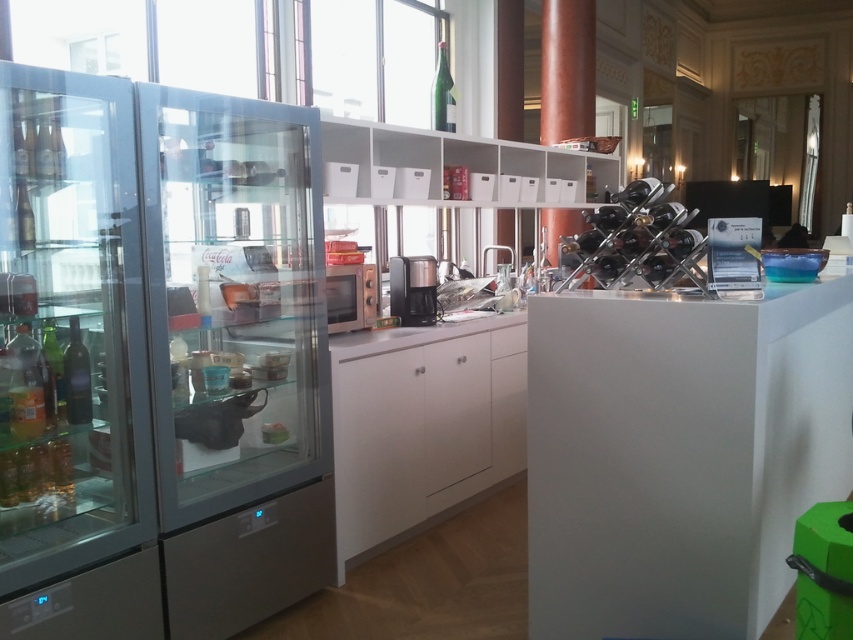
You are a customer in the cafe and want to know if you can slide a narrow book between the transparent glass door at left and the white matte shelves at upper center. The book is 1 inch thick. Can it fit?

The transparent glass door at left is thinner than white matte shelves at upper center. Since the book is 1 inch thick, it depends on the available space between them. However, without knowing the exact gap width, we can only state the relative thickness of the objects, not the fit.

You are standing at the entrance of the modern, well lit cafe and want to get a drink from the transparent glass fridge at left. Is the fridge positioned to your left or right side relative to the entrance?

The transparent glass fridge at left is located at point (73, 364) which places it to your left side relative to the entrance.

You are a customer in this cafe and you want to grab both the black plastic coffee maker at center and the green glass bottle at upper center. Which one do you need to reach for first if you are standing to the right of both objects?

Since the black plastic coffee maker at center is to the left of the green glass bottle at upper center, you should reach for the black plastic coffee maker at center first because it is closer to your right side.